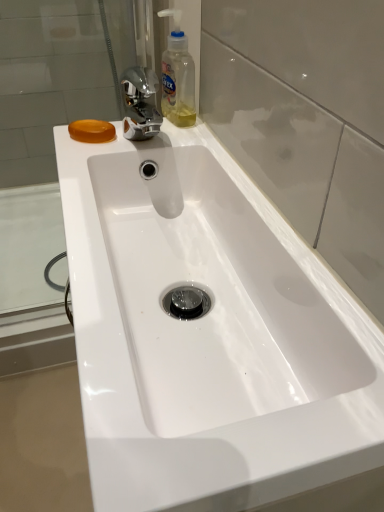
Question: From a real-world perspective, is translucent plastic bottle at upper center located beneath orange translucent soap at upper left?

Choices:
 (A) yes
 (B) no

Answer: (B)

Question: Does translucent plastic bottle at upper center have a greater height compared to orange translucent soap at upper left?

Choices:
 (A) no
 (B) yes

Answer: (B)

Question: Does translucent plastic bottle at upper center appear on the right side of orange translucent soap at upper left?

Choices:
 (A) no
 (B) yes

Answer: (B)

Question: Could you tell me if translucent plastic bottle at upper center is turned towards orange translucent soap at upper left?

Choices:
 (A) no
 (B) yes

Answer: (B)

Question: From a real-world perspective, does translucent plastic bottle at upper center stand above orange translucent soap at upper left?

Choices:
 (A) no
 (B) yes

Answer: (B)

Question: Considering the relative sizes of translucent plastic bottle at upper center and orange translucent soap at upper left in the image provided, is translucent plastic bottle at upper center smaller than orange translucent soap at upper left?

Choices:
 (A) no
 (B) yes

Answer: (A)

Question: Is transparent glass door at center taller than orange translucent soap at upper left?

Choices:
 (A) no
 (B) yes

Answer: (B)

Question: Could you tell me if transparent glass door at center is facing orange translucent soap at upper left?

Choices:
 (A) no
 (B) yes

Answer: (B)

Question: Is transparent glass door at center located outside orange translucent soap at upper left?

Choices:
 (A) no
 (B) yes

Answer: (B)

Question: Is the depth of transparent glass door at center greater than that of orange translucent soap at upper left?

Choices:
 (A) no
 (B) yes

Answer: (A)

Question: Would you say transparent glass door at center contains orange translucent soap at upper left?

Choices:
 (A) no
 (B) yes

Answer: (A)

Question: Considering the relative sizes of transparent glass door at center and orange translucent soap at upper left in the image provided, is transparent glass door at center smaller than orange translucent soap at upper left?

Choices:
 (A) no
 (B) yes

Answer: (A)

Question: Can you confirm if transparent glass door at center is taller than translucent plastic bottle at upper center?

Choices:
 (A) no
 (B) yes

Answer: (B)